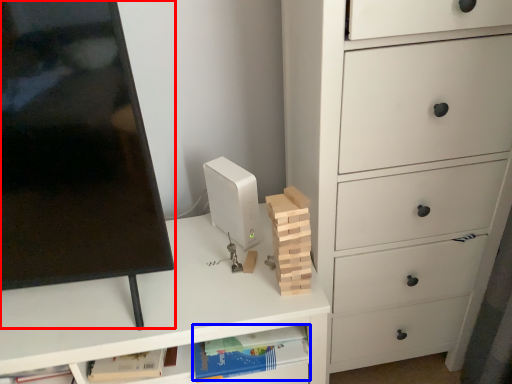
Question: Which object is further to the camera taking this photo, computer monitor (highlighted by a red box) or book (highlighted by a blue box)?

Choices:
 (A) computer monitor
 (B) book

Answer: (B)